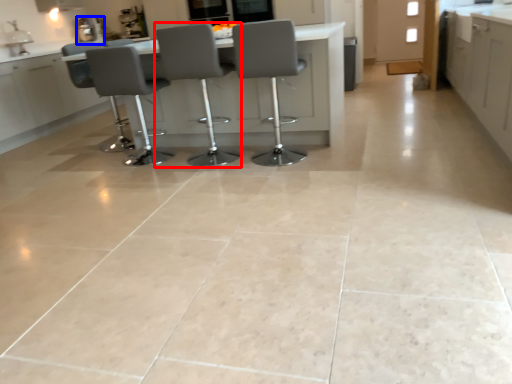
Question: Which object appears closest to the camera in this image, chair (highlighted by a red box) or appliance (highlighted by a blue box)?

Choices:
 (A) chair
 (B) appliance

Answer: (A)